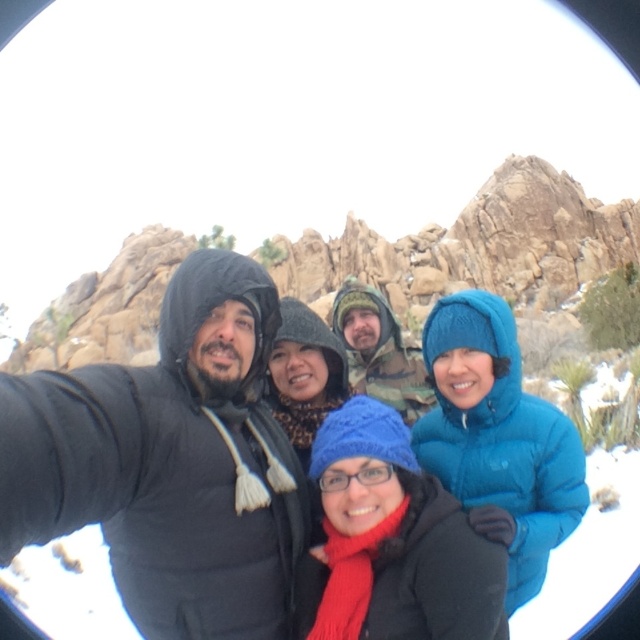
The height and width of the screenshot is (640, 640). Find the location of `matte black jacket at center`. matte black jacket at center is located at coordinates (170, 465).

Between matte black jacket at center and knitted blue hat at center, which one has less height?

knitted blue hat at center is shorter.

Locate an element on the screen. matte black jacket at center is located at coordinates (170, 465).

Find the location of a particular element. matte black jacket at center is located at coordinates (170, 465).